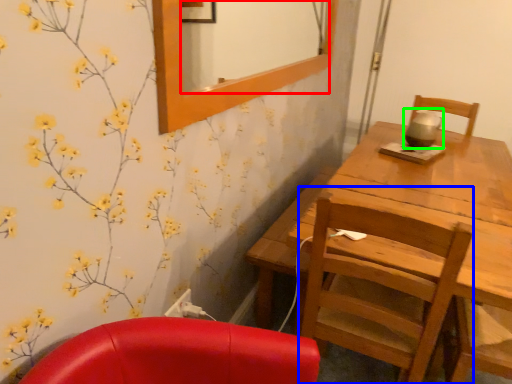
Question: Which is nearer to the mirror (highlighted by a red box)? chair (highlighted by a blue box) or tea pot (highlighted by a green box).

Choices:
 (A) chair
 (B) tea pot

Answer: (B)